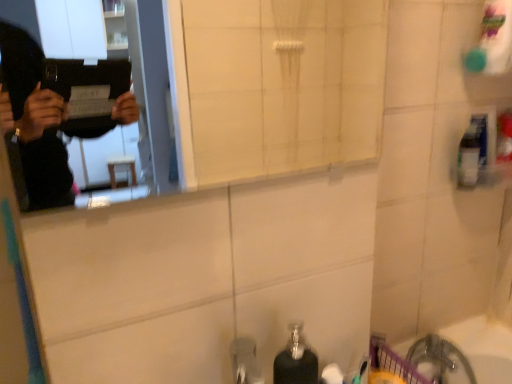
Question: In the image, is black matte soap dispenser at lower center on the left side or the right side of clear plastic bottle at upper right?

Choices:
 (A) right
 (B) left

Answer: (B)

Question: From a real-world perspective, relative to clear plastic bottle at upper right, is black matte soap dispenser at lower center vertically above or below?

Choices:
 (A) above
 (B) below

Answer: (B)

Question: Which is farther from the white plastic bath at lower right?

Choices:
 (A) black matte soap dispenser at lower center
 (B) clear plastic bottle at upper right
 (C) white glossy mirror at upper center

Answer: (C)

Question: Which of these objects is positioned farthest from the white plastic bath at lower right?

Choices:
 (A) clear plastic bottle at upper right
 (B) black matte soap dispenser at lower center
 (C) white glossy mirror at upper center

Answer: (C)